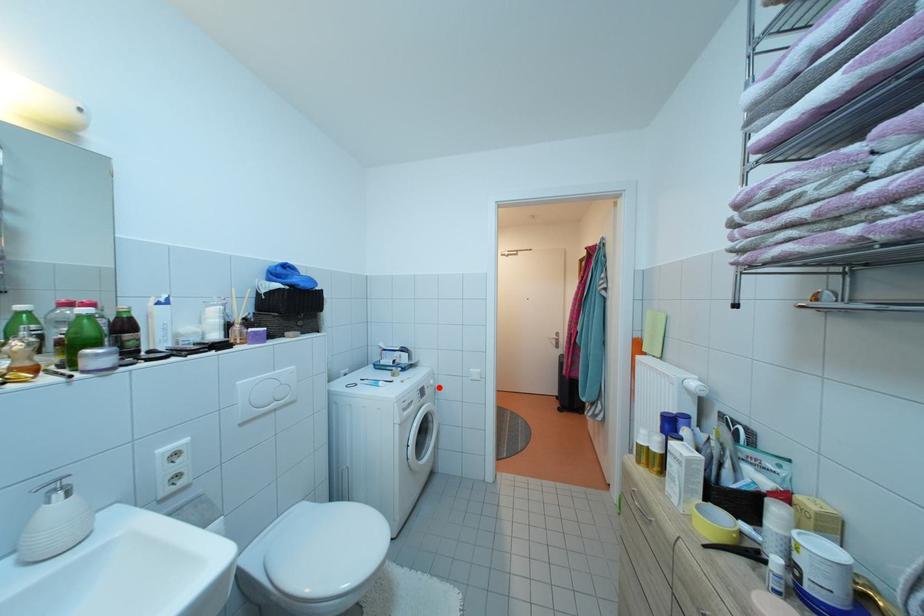
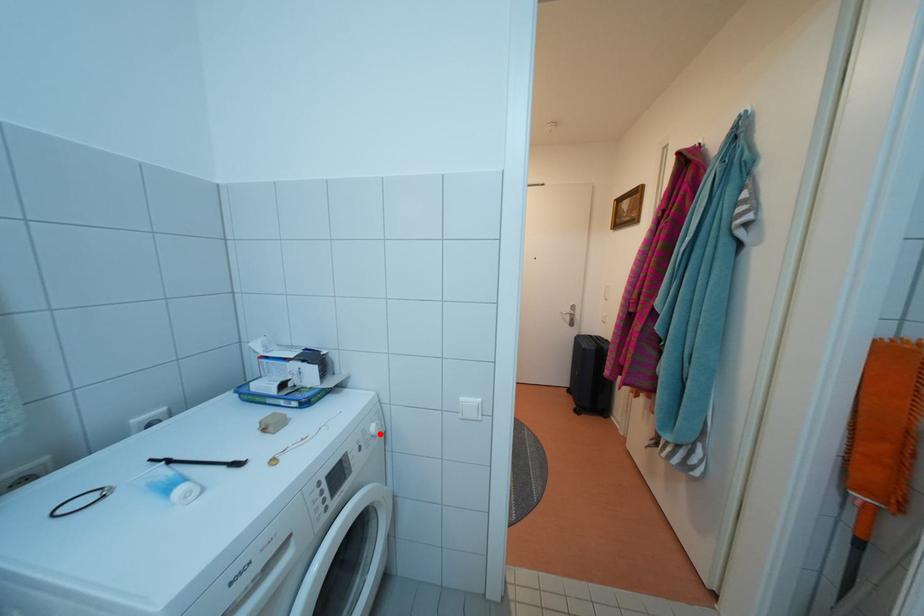
I am providing you with two images of the same scene from different viewpoints. A red point is marked on the first image and another point is marked on the second image. Is the marked point in image1 the same physical position as the marked point in image2?

Yes